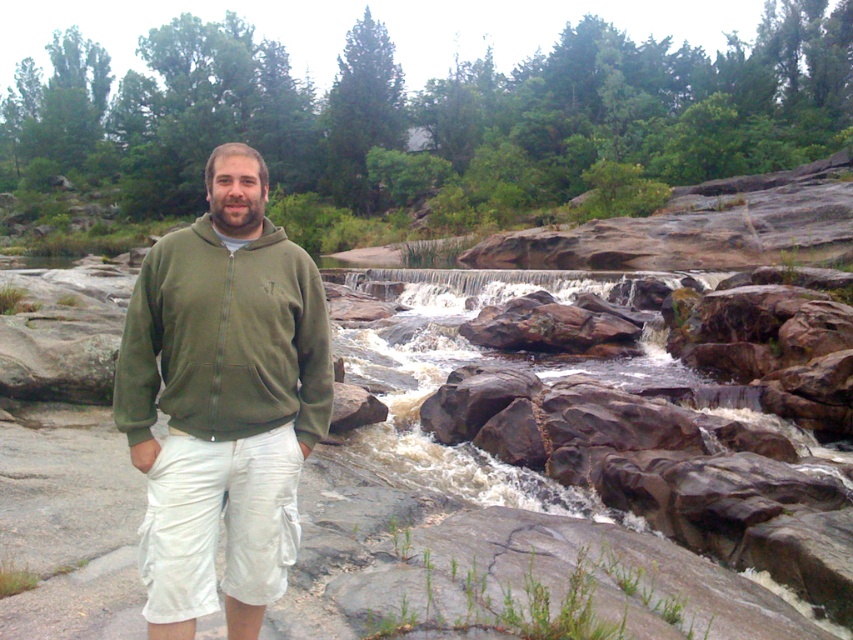
Question: Is green fleece jacket at center wider than olive green fleece sweatshirt at left?

Choices:
 (A) yes
 (B) no

Answer: (A)

Question: Is green fleece jacket at center to the left of olive green fleece sweatshirt at left from the viewer's perspective?

Choices:
 (A) yes
 (B) no

Answer: (A)

Question: Can you confirm if green fleece jacket at center is smaller than olive green fleece sweatshirt at left?

Choices:
 (A) yes
 (B) no

Answer: (B)

Question: Which of the following is the farthest from the observer?

Choices:
 (A) (178, 298)
 (B) (183, 602)

Answer: (A)

Question: Which point is closer to the camera?

Choices:
 (A) green fleece jacket at center
 (B) olive green fleece sweatshirt at left

Answer: (A)